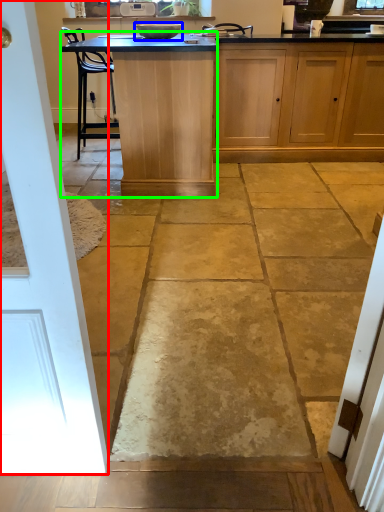
Question: Estimate the real-world distances between objects in this image. Which object is farther from door (highlighted by a red box), appliance (highlighted by a blue box) or table (highlighted by a green box)?

Choices:
 (A) appliance
 (B) table

Answer: (A)